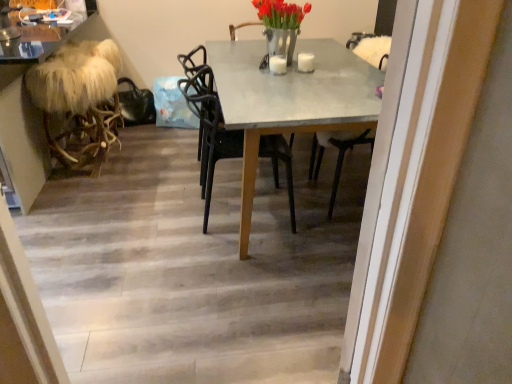
Question: Can you confirm if furry white stool at left is taller than metallic silver vase at upper center?

Choices:
 (A) yes
 (B) no

Answer: (A)

Question: Is furry white stool at left smaller than metallic silver vase at upper center?

Choices:
 (A) yes
 (B) no

Answer: (B)

Question: Is furry white stool at left turned away from metallic silver vase at upper center?

Choices:
 (A) yes
 (B) no

Answer: (A)

Question: Is furry white stool at left in front of metallic silver vase at upper center?

Choices:
 (A) yes
 (B) no

Answer: (B)

Question: Is furry white stool at left located outside metallic silver vase at upper center?

Choices:
 (A) yes
 (B) no

Answer: (A)

Question: Can metallic silver vase at upper center be found inside furry white stool at left?

Choices:
 (A) no
 (B) yes

Answer: (A)

Question: Can you confirm if furry white stool at left is wider than concrete gray table at center?

Choices:
 (A) no
 (B) yes

Answer: (A)

Question: Does furry white stool at left turn towards concrete gray table at center?

Choices:
 (A) yes
 (B) no

Answer: (B)

Question: Is furry white stool at left positioned with its back to concrete gray table at center?

Choices:
 (A) no
 (B) yes

Answer: (B)

Question: From a real-world perspective, is furry white stool at left over concrete gray table at center?

Choices:
 (A) yes
 (B) no

Answer: (B)

Question: Can you confirm if furry white stool at left is smaller than concrete gray table at center?

Choices:
 (A) yes
 (B) no

Answer: (A)

Question: Considering the relative positions of furry white stool at left and concrete gray table at center in the image provided, is furry white stool at left to the right of concrete gray table at center from the viewer's perspective?

Choices:
 (A) yes
 (B) no

Answer: (B)

Question: Is furry white stool at left inside concrete gray table at center?

Choices:
 (A) yes
 (B) no

Answer: (B)